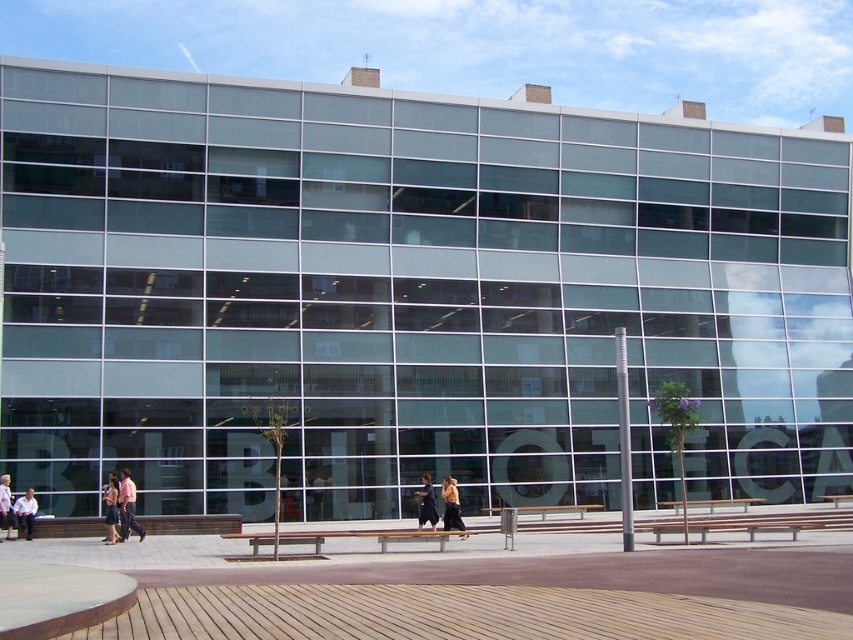
Can you confirm if brown wooden bench at center is positioned below dark blue jeans at center?

Indeed, brown wooden bench at center is positioned under dark blue jeans at center.

Does brown wooden bench at center have a larger size compared to dark blue jeans at center?

No.

Between point (253, 540) and point (459, 509), which one is positioned in front?

Positioned in front is point (253, 540).

The width and height of the screenshot is (853, 640). What are the coordinates of `brown wooden bench at center` in the screenshot? It's located at (378, 536).

Is transparent glass benches at center positioned at the back of light brown leather jacket at lower left?

That is True.

Between transparent glass benches at center and light brown leather jacket at lower left, which one appears on the right side from the viewer's perspective?

transparent glass benches at center

Where is `transparent glass benches at center`? transparent glass benches at center is located at coordinates (409, 296).

Is light brown leather jacket at lower left below wooden bench at center?

No.

Can you confirm if light brown leather jacket at lower left is taller than wooden bench at center?

Yes, light brown leather jacket at lower left is taller than wooden bench at center.

Is point (106, 508) in front of point (492, 508)?

Yes, it is in front of point (492, 508).

The width and height of the screenshot is (853, 640). Find the location of `light brown leather jacket at lower left`. light brown leather jacket at lower left is located at coordinates (109, 508).